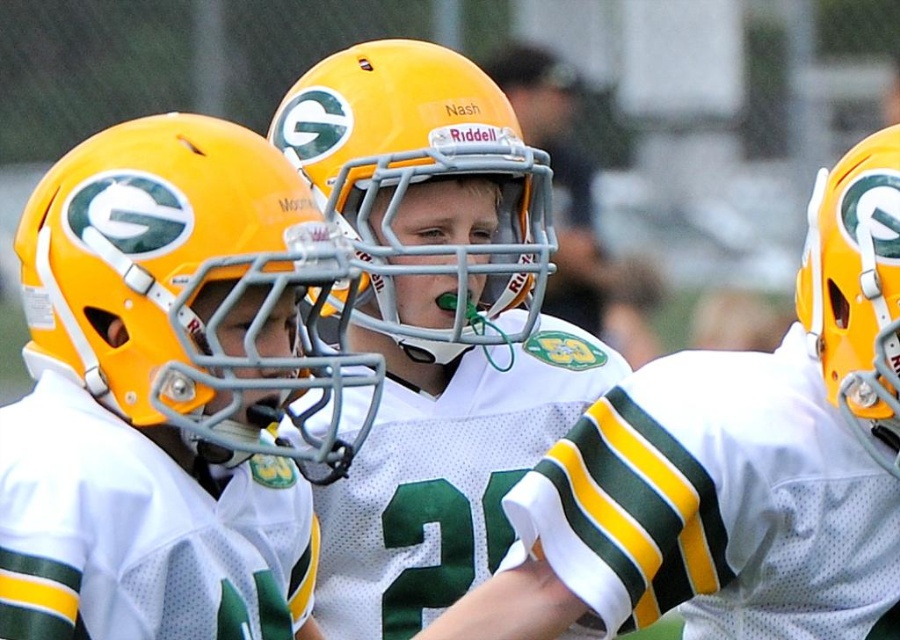
You are a photographer at the football game. You need to capture a photo where both the matte yellow football helmet at center and the matte yellow helmet at right are visible. Based on their positions, which helmet should be placed on the left side of the photo to include both?

The matte yellow football helmet at center should be placed on the left side of the photo because it is already positioned to the left of the matte yellow helmet at right.

You are a photographer trying to capture a closeup of the celebration between the players. You notice two points in the image labeled as point (x=264, y=200) and point (x=477, y=280). Which point should you focus on to ensure the subject is in sharp focus if you want the closest part of the celebration to be clear?

Point (x=264, y=200) is closer to the camera than point (x=477, y=280), so focusing on point (x=264, y=200) will ensure the closest part of the celebration is in sharp focus.